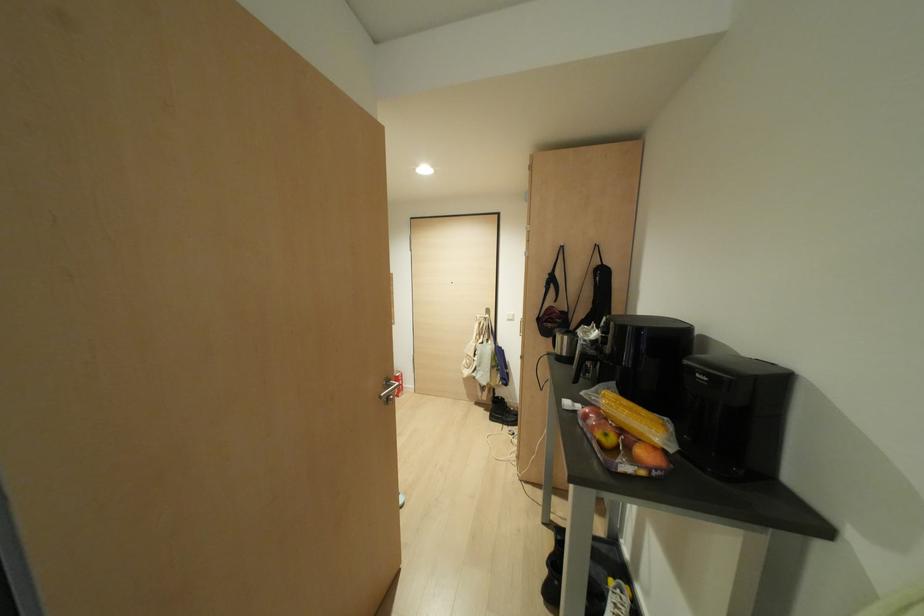
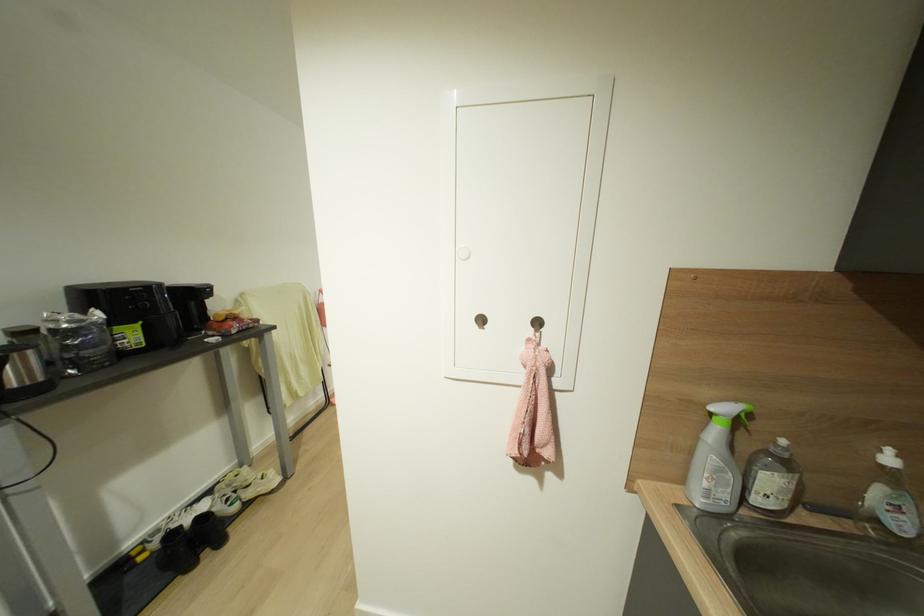
Question: I am providing you with two images of the same scene from different viewpoints. After the viewpoint changes to image2, which objects are now occluded?

Choices:
 (A) soap dispenser pump
 (B) small spray bottle
 (C) red apple
 (D) black shoe

Answer: (C)